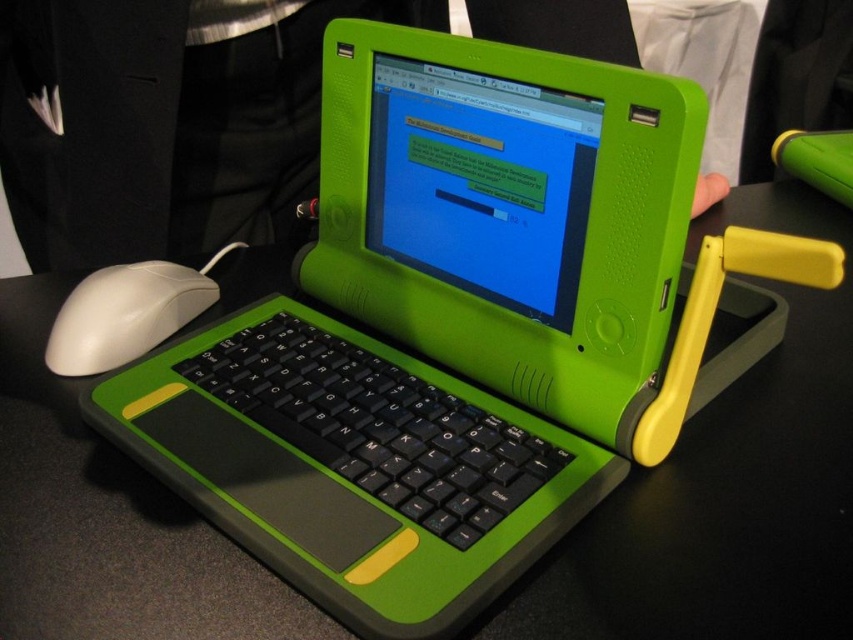
You are setting up a presentation and need to place your laptop on the black matte table at center and position your black rubberized keyboard at center properly. According to the scene, where should you place the keyboard relative to the table?

The black rubberized keyboard at center should be placed to the left of the black matte table at center since the table is to the right of the keyboard as per the description.

You are a person sitting at the black matte table at center and want to click the mouse. Can you easily reach the white matte mouse at left from your current position?

The black matte table at center is closer to the viewer than white matte mouse at left, so the mouse is farther away. You might need to stretch your arm to reach it.

You are setting up a new computer workstation. You have a black matte table at center and a white matte mouse at left. Which object should you place the laptop on to ensure it is at a comfortable height for typing?

The black matte table at center is much taller than the white matte mouse at left, so placing the laptop on the black matte table at center would provide a more comfortable height for typing.